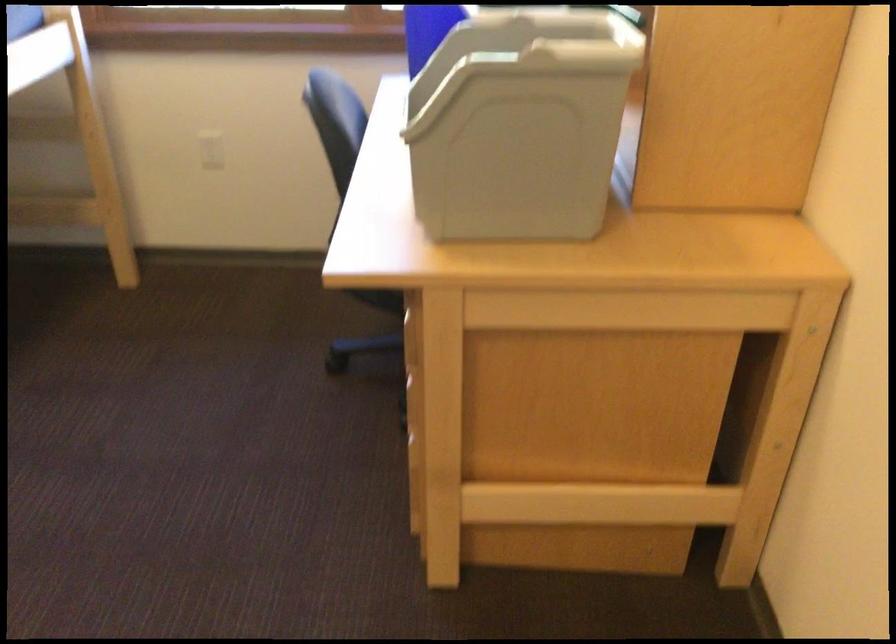
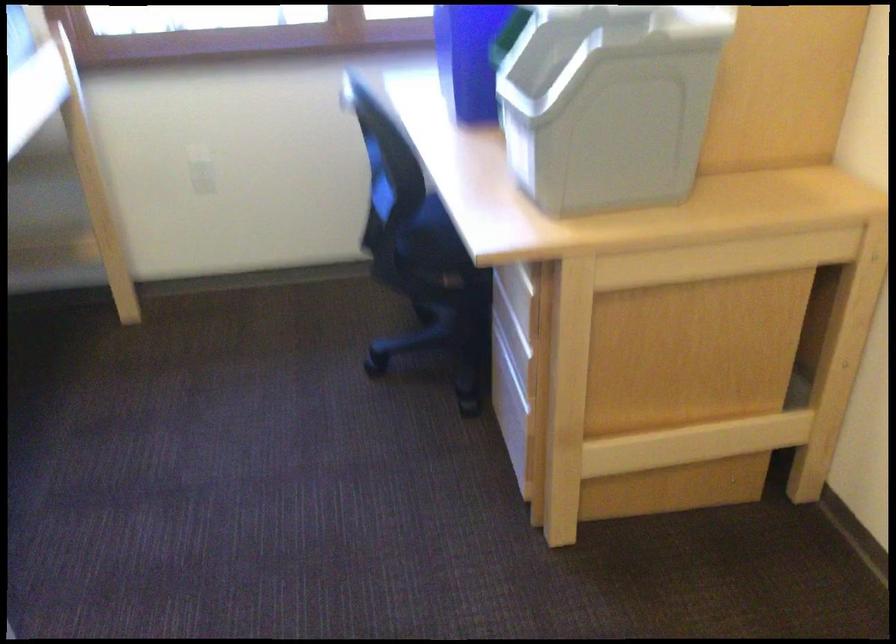
Question: In a continuous first-person perspective shot, in which direction is the camera moving?

Choices:
 (A) Left
 (B) Right
 (C) Forward
 (D) Backward

Answer: (A)